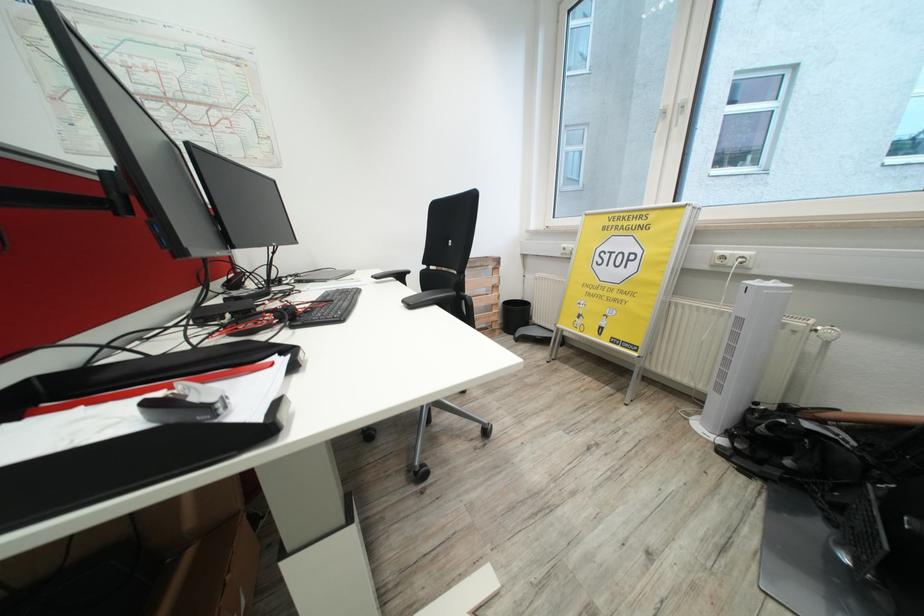
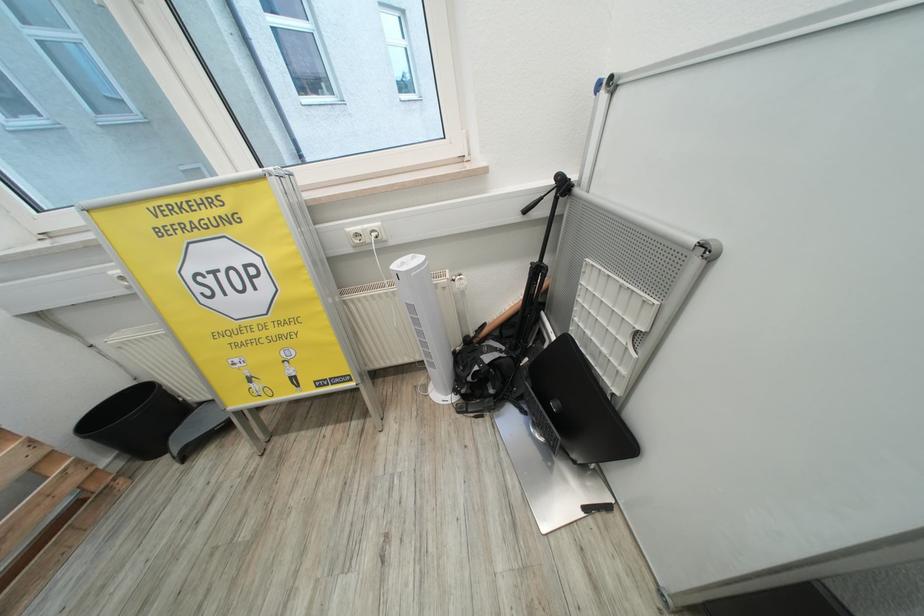
The images are taken continuously from a first-person perspective. In which direction is your viewpoint rotating?

The camera's rotation is toward right-down.